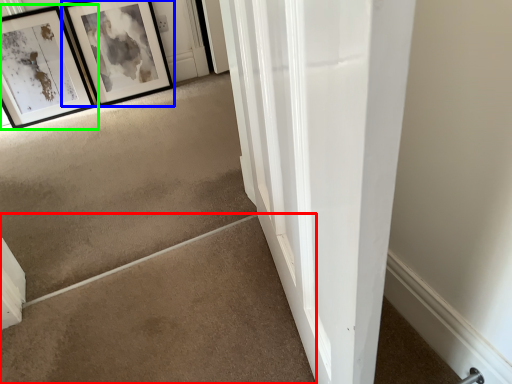
Question: Based on their relative distances, which object is farther from concrete (highlighted by a red box)? Choose from picture frame (highlighted by a blue box) and picture frame (highlighted by a green box).

Choices:
 (A) picture frame
 (B) picture frame

Answer: (A)